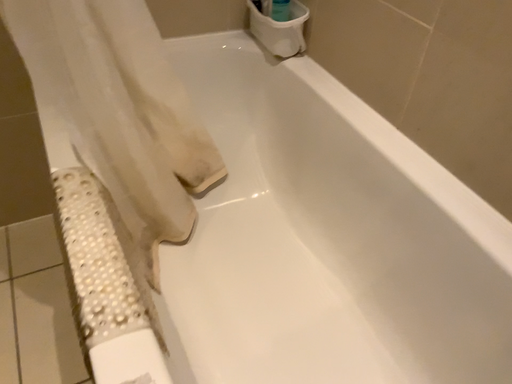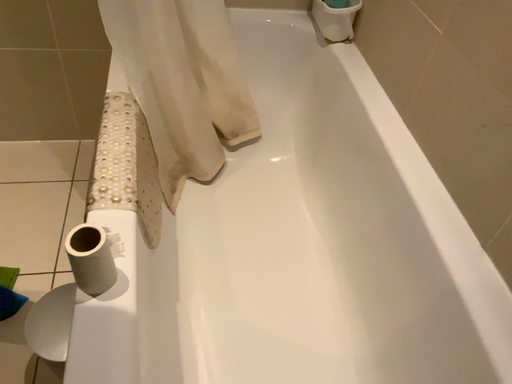
Question: How did the camera likely rotate when shooting the video?

Choices:
 (A) rotated left
 (B) rotated right

Answer: (A)